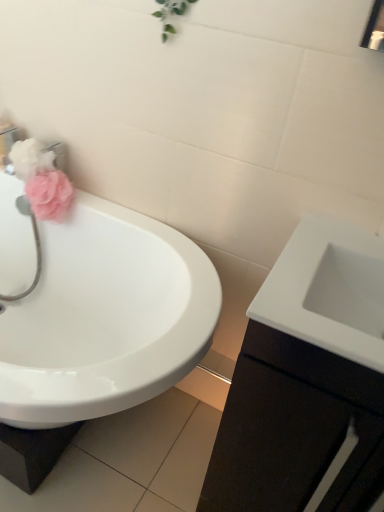
Question: Does white glossy sink at right, the first sink when ordered from right to left, appear on the left side of matte pink sponge at left, which ranks as the 1th flower in bottom-to-top order?

Choices:
 (A) no
 (B) yes

Answer: (A)

Question: Considering the relative positions of white glossy sink at right, the first sink when ordered from right to left, and matte pink sponge at left, the 2th flower in the top-to-bottom sequence, in the image provided, is white glossy sink at right, the first sink when ordered from right to left, to the right of matte pink sponge at left, the 2th flower in the top-to-bottom sequence, from the viewer's perspective?

Choices:
 (A) no
 (B) yes

Answer: (B)

Question: Considering the relative sizes of white glossy sink at right, the first sink when ordered from right to left, and matte pink sponge at left, the 2th flower in the top-to-bottom sequence, in the image provided, is white glossy sink at right, the first sink when ordered from right to left, shorter than matte pink sponge at left, the 2th flower in the top-to-bottom sequence,?

Choices:
 (A) yes
 (B) no

Answer: (B)

Question: Is white glossy sink at right, the first sink when ordered from right to left, smaller than matte pink sponge at left, which ranks as the 1th flower in bottom-to-top order?

Choices:
 (A) no
 (B) yes

Answer: (A)

Question: From a real-world perspective, is white glossy sink at right, the first sink when ordered from right to left, positioned under matte pink sponge at left, the 2th flower in the top-to-bottom sequence, based on gravity?

Choices:
 (A) no
 (B) yes

Answer: (A)

Question: Does white glossy sink at right, the second sink in the left-to-right sequence, have a greater width compared to matte pink sponge at left, the 2th flower in the top-to-bottom sequence?

Choices:
 (A) yes
 (B) no

Answer: (A)

Question: Can you confirm if white glossy cabinet at right is smaller than pink fabric at left?

Choices:
 (A) yes
 (B) no

Answer: (B)

Question: Is white glossy cabinet at right aimed at pink fabric at left?

Choices:
 (A) yes
 (B) no

Answer: (B)

Question: From a real-world perspective, is white glossy cabinet at right on pink fabric at left?

Choices:
 (A) no
 (B) yes

Answer: (A)

Question: Is white glossy cabinet at right bigger than pink fabric at left?

Choices:
 (A) yes
 (B) no

Answer: (A)

Question: Is white glossy cabinet at right positioned with its back to pink fabric at left?

Choices:
 (A) yes
 (B) no

Answer: (B)

Question: Does white glossy cabinet at right appear on the right side of pink fabric at left?

Choices:
 (A) no
 (B) yes

Answer: (B)

Question: Is white glossy cabinet at right bigger than white glossy sink at right, the second sink in the left-to-right sequence?

Choices:
 (A) no
 (B) yes

Answer: (B)